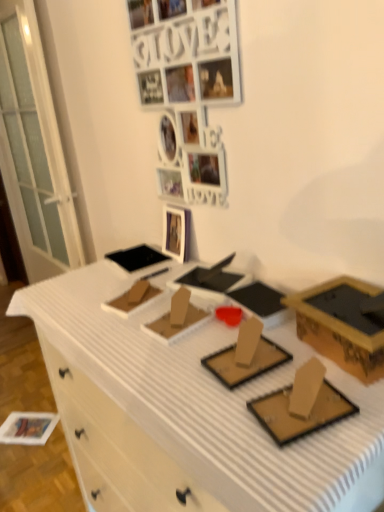
Question: Is white glossy picture frame at upper center aimed at white cardboard desk at center?

Choices:
 (A) yes
 (B) no

Answer: (B)

Question: Considering the relative positions of white glossy picture frame at upper center and white cardboard desk at center in the image provided, is white glossy picture frame at upper center to the right of white cardboard desk at center from the viewer's perspective?

Choices:
 (A) no
 (B) yes

Answer: (A)

Question: Is white glossy picture frame at upper center thinner than white cardboard desk at center?

Choices:
 (A) no
 (B) yes

Answer: (B)

Question: Is white glossy picture frame at upper center not within white cardboard desk at center?

Choices:
 (A) yes
 (B) no

Answer: (A)

Question: Is the position of white glossy picture frame at upper center more distant than that of white cardboard desk at center?

Choices:
 (A) yes
 (B) no

Answer: (A)

Question: Considering the relative sizes of white glossy picture frame at upper center and white cardboard desk at center in the image provided, is white glossy picture frame at upper center smaller than white cardboard desk at center?

Choices:
 (A) no
 (B) yes

Answer: (B)

Question: From the image's perspective, does white matte photo frame at upper center appear lower than gold cardboard box at right?

Choices:
 (A) no
 (B) yes

Answer: (A)

Question: Is white matte photo frame at upper center in front of gold cardboard box at right?

Choices:
 (A) no
 (B) yes

Answer: (A)

Question: Is white matte photo frame at upper center wider than gold cardboard box at right?

Choices:
 (A) yes
 (B) no

Answer: (B)

Question: Is the position of white matte photo frame at upper center more distant than that of gold cardboard box at right?

Choices:
 (A) yes
 (B) no

Answer: (A)

Question: Can you confirm if white matte photo frame at upper center is shorter than gold cardboard box at right?

Choices:
 (A) no
 (B) yes

Answer: (A)

Question: Could you tell me if white matte photo frame at upper center is facing gold cardboard box at right?

Choices:
 (A) yes
 (B) no

Answer: (B)

Question: From a real-world perspective, is white matte drawer at lower left located higher than gold cardboard box at right?

Choices:
 (A) no
 (B) yes

Answer: (A)